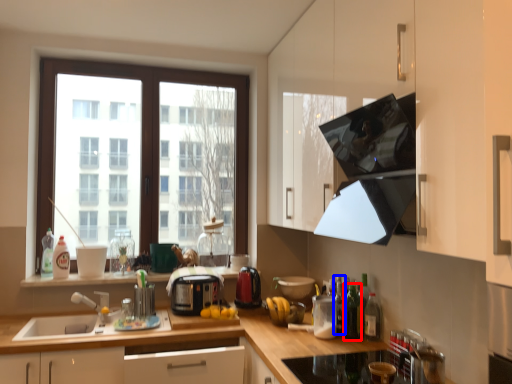
Question: Which of the following is the closest to the observer, bottle (highlighted by a red box) or bottle (highlighted by a blue box)?

Choices:
 (A) bottle
 (B) bottle

Answer: (A)